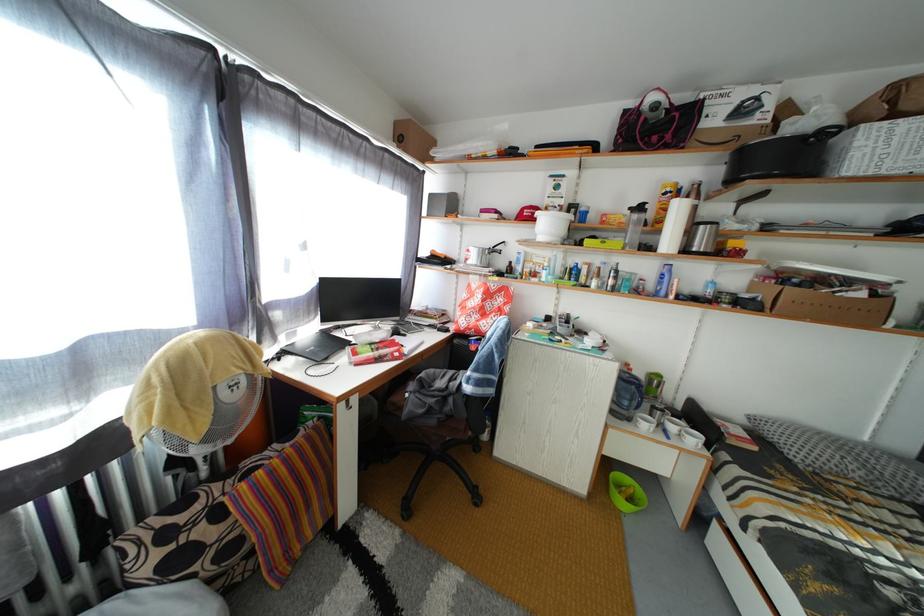
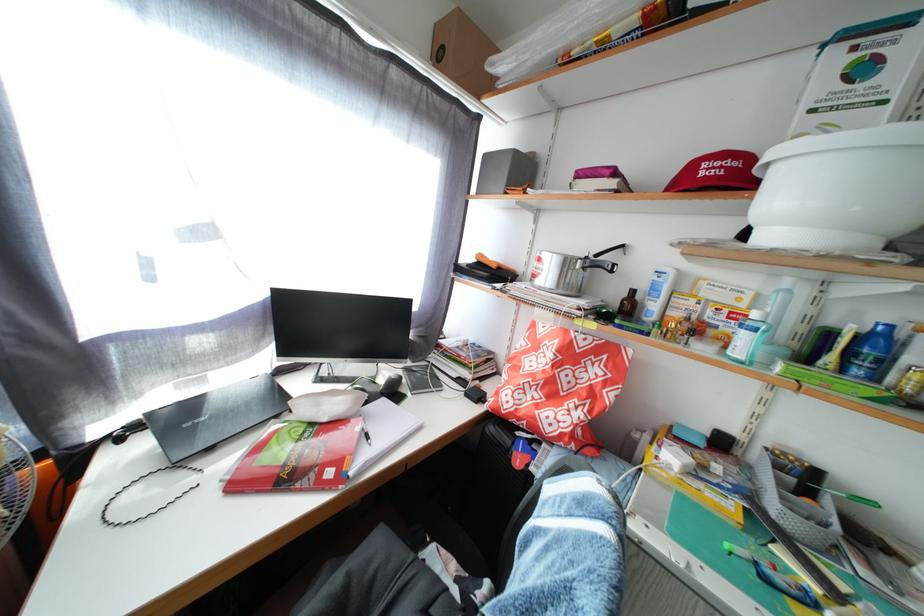
Where in the second image is the point corresponding to [406,361] from the first image?

(338, 480)